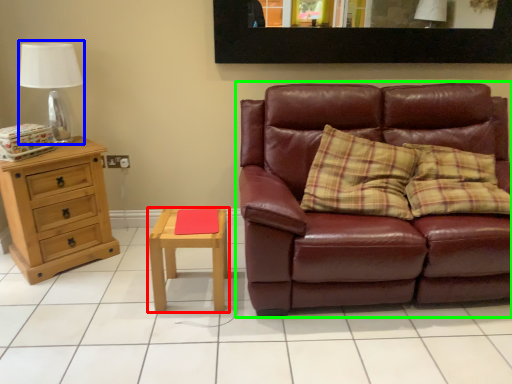
Question: Based on their relative distances, which object is farther from nightstand (highlighted by a red box)? Choose from table lamp (highlighted by a blue box) and studio couch (highlighted by a green box).

Choices:
 (A) table lamp
 (B) studio couch

Answer: (A)